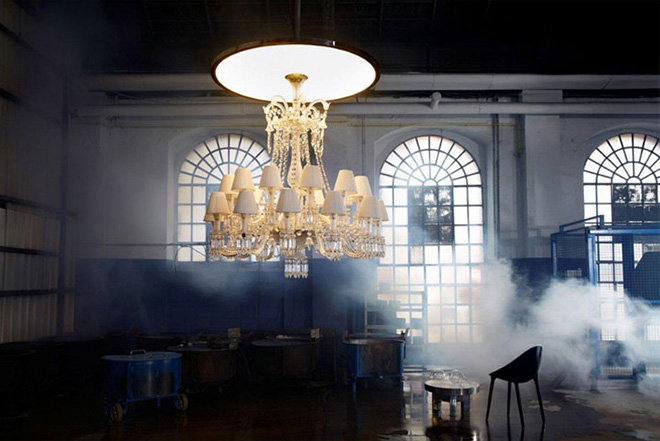
Identify the location of chandelier. Image resolution: width=660 pixels, height=441 pixels. (305, 154).